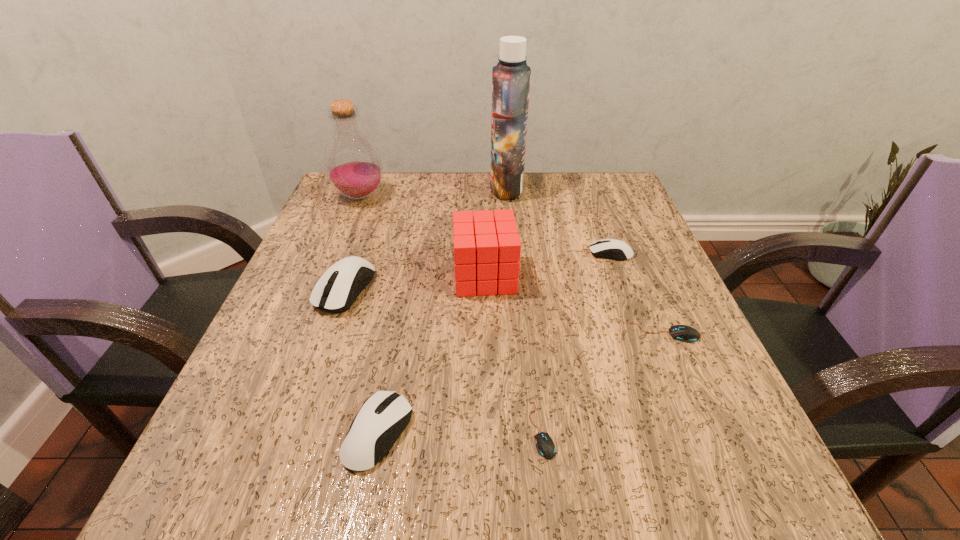
Identify the location of free location located 0.180m on the left of the red cube. The height and width of the screenshot is (540, 960). (362, 276).

Locate an element on the screen. Image resolution: width=960 pixels, height=540 pixels. vacant space situated on the right of the fourth tallest object is located at coordinates point(551,289).

Where is `vacant space located 0.110m on the left of the fifth tallest object`? This screenshot has height=540, width=960. vacant space located 0.110m on the left of the fifth tallest object is located at coordinates (267, 433).

Find the location of a particular element. Image resolution: width=960 pixels, height=540 pixels. vacant region located on the left of the farthest mouse is located at coordinates (512, 253).

Locate an element on the screen. The height and width of the screenshot is (540, 960). free space located on the back of the third farthest mouse is located at coordinates (612, 207).

Locate an element on the screen. The width and height of the screenshot is (960, 540). free space located 0.310m on the left of the shortest object is located at coordinates (310, 429).

At what (x,y) coordinates should I click in order to perform the action: click on shampoo that is at the far edge. Please return your answer as a coordinate pair (x, y). This screenshot has height=540, width=960. Looking at the image, I should click on (511, 76).

I want to click on bottle present at the far edge, so click(x=352, y=162).

The width and height of the screenshot is (960, 540). Identify the location of bottle present at the left edge. (352, 162).

Image resolution: width=960 pixels, height=540 pixels. What are the coordinates of `mouse located in the left edge section of the desktop` in the screenshot? It's located at (333, 292).